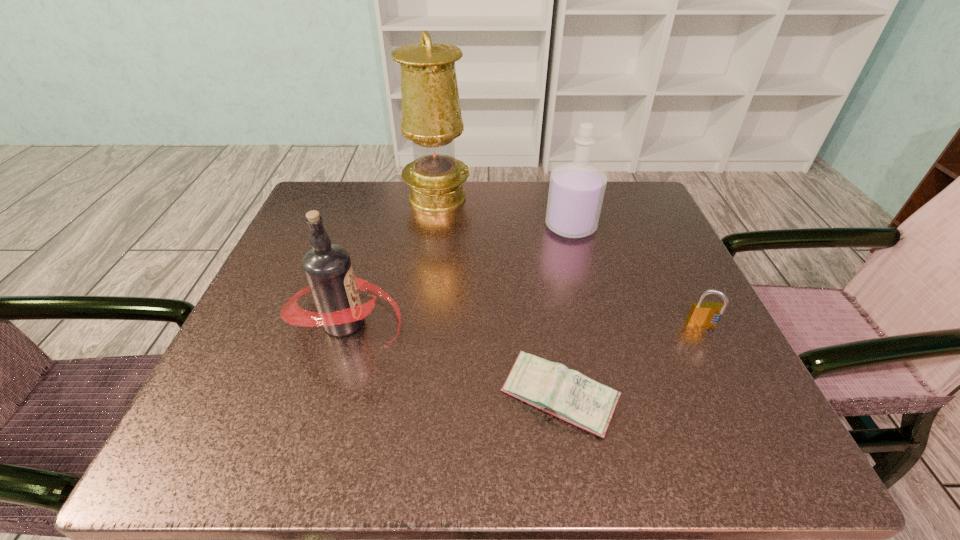
Identify the location of free spot between the tallest object and the perfume. (504, 212).

This screenshot has width=960, height=540. Find the location of `vacant area between the fourth tallest object and the perfume`. vacant area between the fourth tallest object and the perfume is located at coordinates (636, 276).

Locate an element on the screen. This screenshot has width=960, height=540. vacant region between the root beer and the shortest object is located at coordinates (452, 360).

The width and height of the screenshot is (960, 540). What are the coordinates of `free spot between the tallest object and the second shortest object` in the screenshot? It's located at (570, 262).

Choose which object is the third nearest neighbor to the perfume. Please provide its 2D coordinates. Your answer should be formatted as a tuple, i.e. [(x, y)], where the tuple contains the x and y coordinates of a point satisfying the conditions above.

[(327, 267)]

Select which object appears as the fourth closest to the rightmost object. Please provide its 2D coordinates. Your answer should be formatted as a tuple, i.e. [(x, y)], where the tuple contains the x and y coordinates of a point satisfying the conditions above.

[(431, 115)]

Identify the location of vacant area that satisfies the following two spatial constraints: 1. on the label of the root beer; 2. on the back side of the diary. (324, 397).

The width and height of the screenshot is (960, 540). Identify the location of free spot that satisfies the following two spatial constraints: 1. on the front side of the perfume; 2. on the label of the root beer. (596, 322).